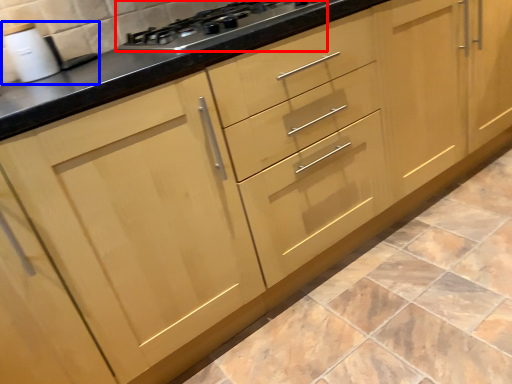
Question: Which object appears farthest to the camera in this image, gas stove (highlighted by a red box) or sink (highlighted by a blue box)?

Choices:
 (A) gas stove
 (B) sink

Answer: (B)